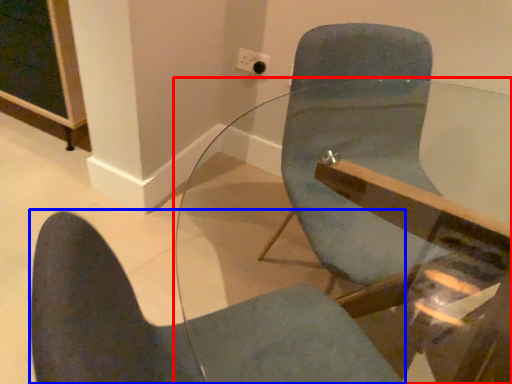
Question: Among these objects, which one is farthest to the camera, table (highlighted by a red box) or chair (highlighted by a blue box)?

Choices:
 (A) table
 (B) chair

Answer: (B)